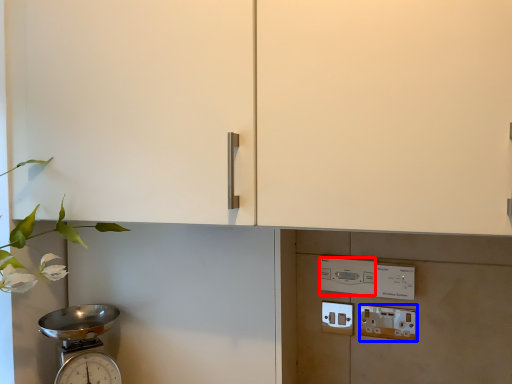
Question: Which point is closer to the camera, light switch (highlighted by a red box) or electric outlet (highlighted by a blue box)?

Choices:
 (A) light switch
 (B) electric outlet

Answer: (B)